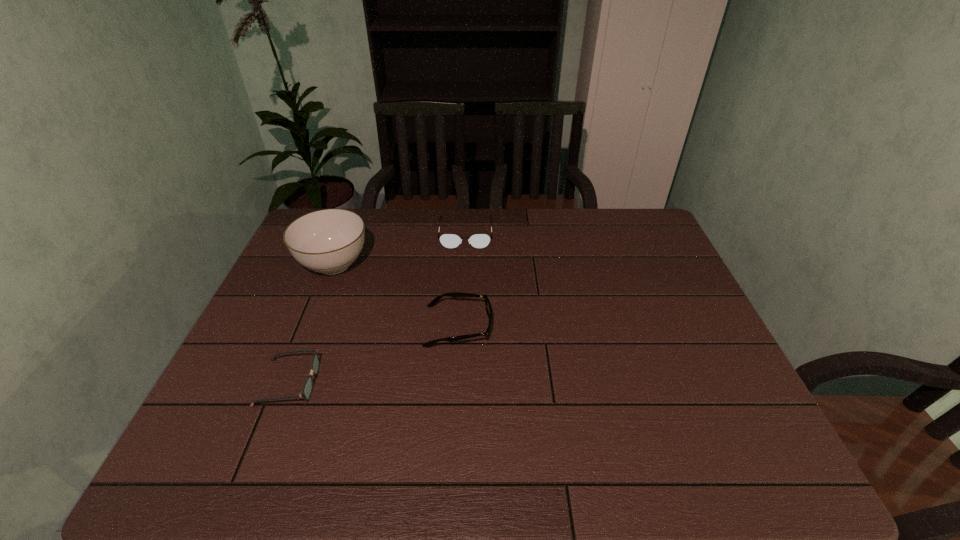
Locate an element on the screen. Image resolution: width=960 pixels, height=540 pixels. vacant space that is in between the leftmost spectacles and the farthest spectacles is located at coordinates click(377, 308).

The height and width of the screenshot is (540, 960). Find the location of `unoccupied position between the tallest object and the nearest spectacles`. unoccupied position between the tallest object and the nearest spectacles is located at coordinates (311, 323).

I want to click on empty space that is in between the third farthest object and the chinaware, so click(396, 295).

Locate an element on the screen. The width and height of the screenshot is (960, 540). vacant region between the chinaware and the farthest spectacles is located at coordinates (399, 249).

Locate an element on the screen. Image resolution: width=960 pixels, height=540 pixels. free spot between the nearest object and the third farthest object is located at coordinates (373, 354).

The width and height of the screenshot is (960, 540). What are the coordinates of `free point between the third farthest object and the chinaware` in the screenshot? It's located at (396, 295).

Locate an element on the screen. Image resolution: width=960 pixels, height=540 pixels. free space that is in between the farthest spectacles and the nearest spectacles is located at coordinates (377, 308).

The height and width of the screenshot is (540, 960). Identify the location of vacant area that lies between the farthest spectacles and the nearest object. (377, 308).

Where is `vacant area that lies between the third farthest object and the chinaware`? The image size is (960, 540). vacant area that lies between the third farthest object and the chinaware is located at coordinates (396, 295).

I want to click on unoccupied position between the farthest spectacles and the nearest spectacles, so click(377, 308).